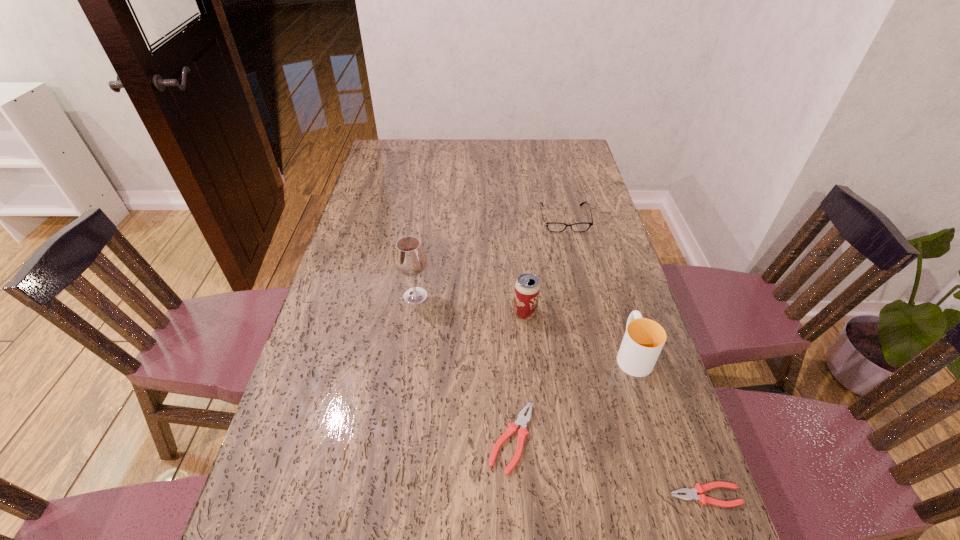
Please point a vacant point for placing a pliers on the left. Please provide its 2D coordinates. Your answer should be formatted as a tuple, i.e. [(x, y)], where the tuple contains the x and y coordinates of a point satisfying the conditions above.

[(349, 391)]